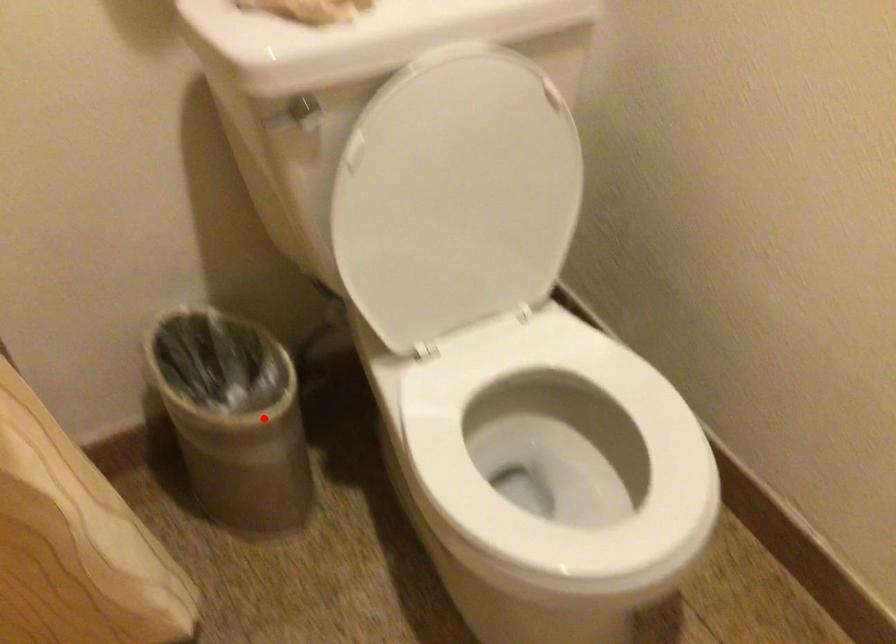
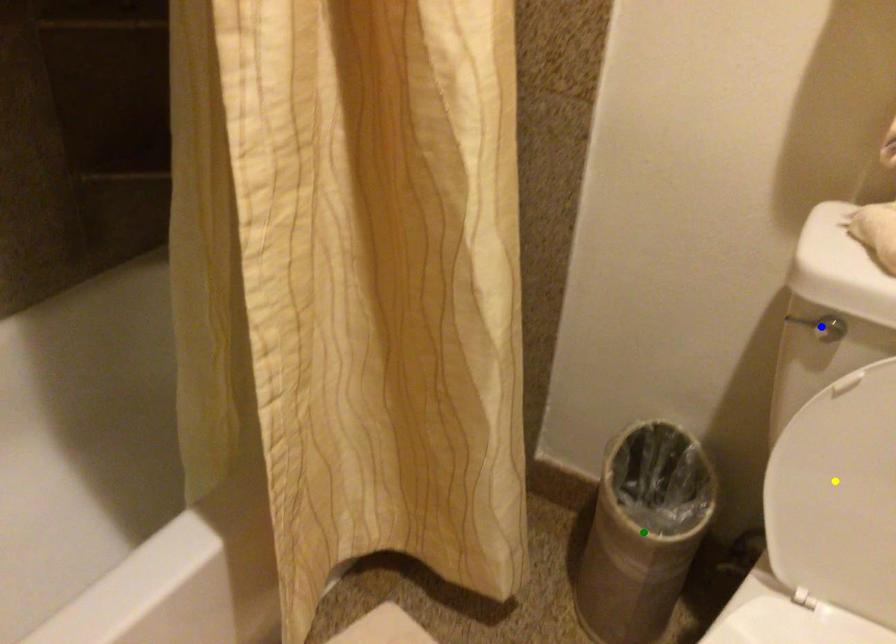
Question: I am providing you with two images of the same scene from different viewpoints. A red point is marked on the first image. You are given multiple points on the second image. Which spot in image 2 lines up with the point in image 1?

Choices:
 (A) yellow point
 (B) green point
 (C) blue point

Answer: (B)